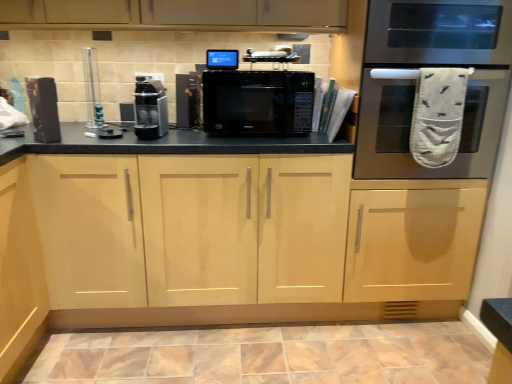
This screenshot has width=512, height=384. Identify the location of vacant space in satin black coffee machine at center, the third appliance from the right (from a real-world perspective). (146, 136).